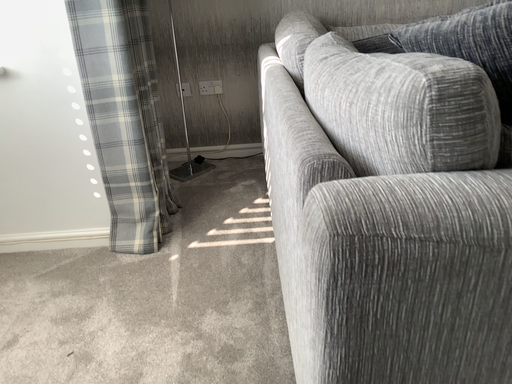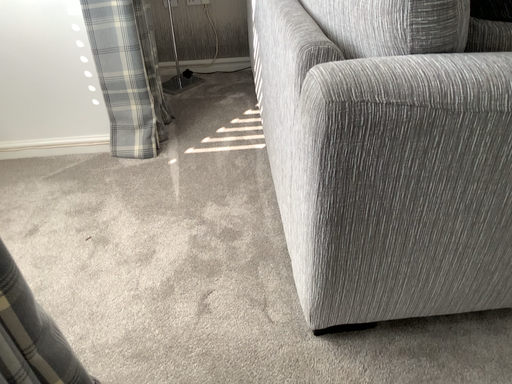
Question: How did the camera likely rotate when shooting the video?

Choices:
 (A) rotated upward
 (B) rotated downward

Answer: (B)